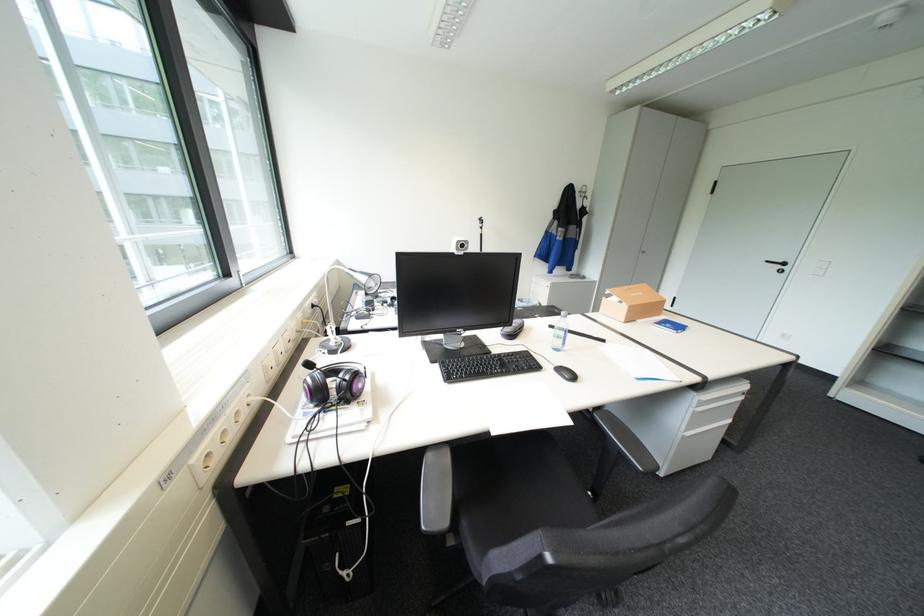
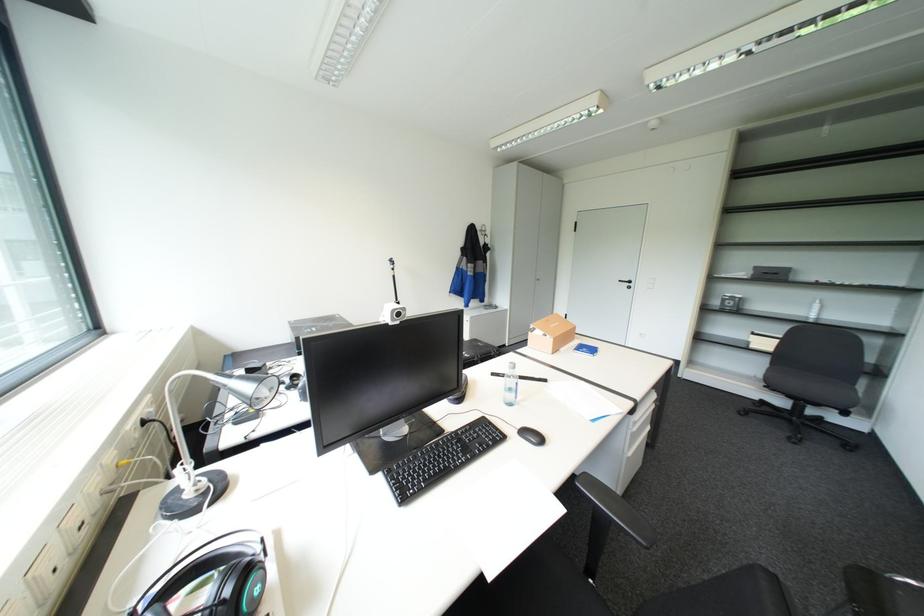
Question: The camera is either moving clockwise (left) or counter-clockwise (right) around the object. The first image is from the beginning of the video and the second image is from the end. Is the camera moving left or right when shooting the video?

Choices:
 (A) Left
 (B) Right

Answer: (A)